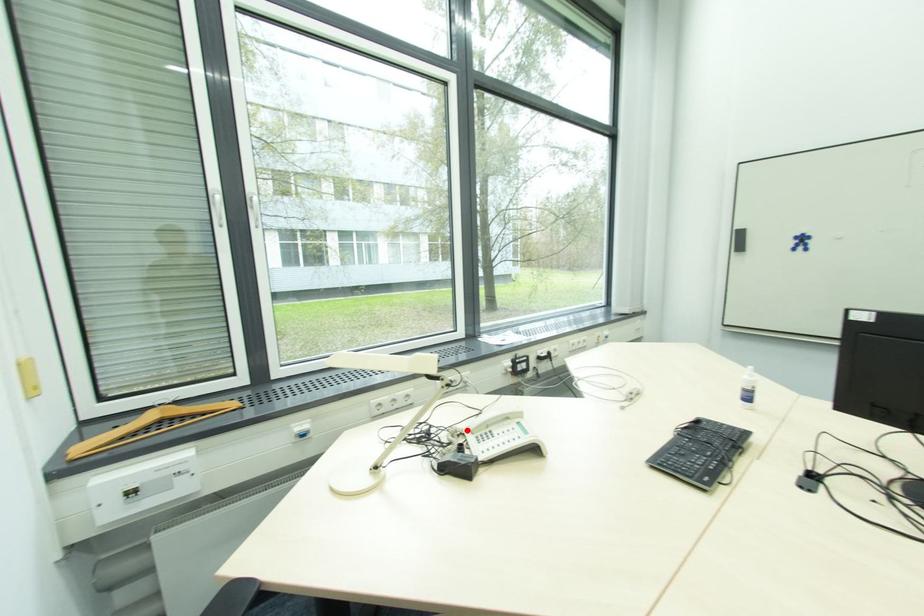
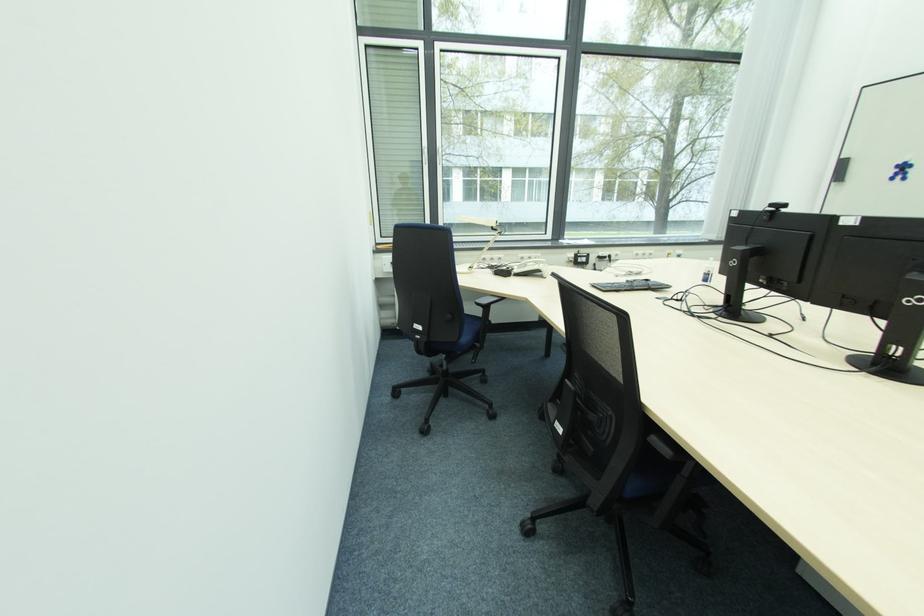
In the second image, find the point that corresponds to the highlighted location in the first image.

(519, 270)